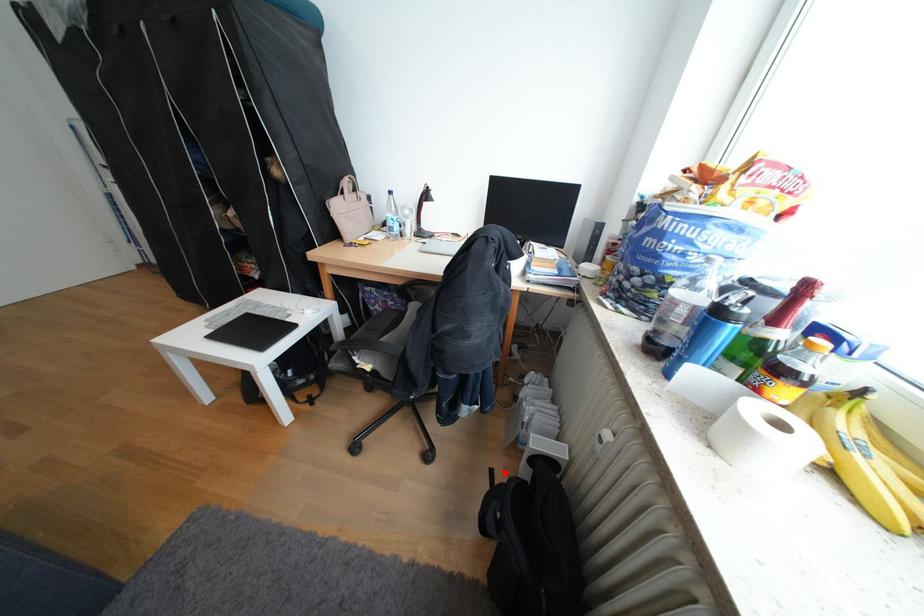
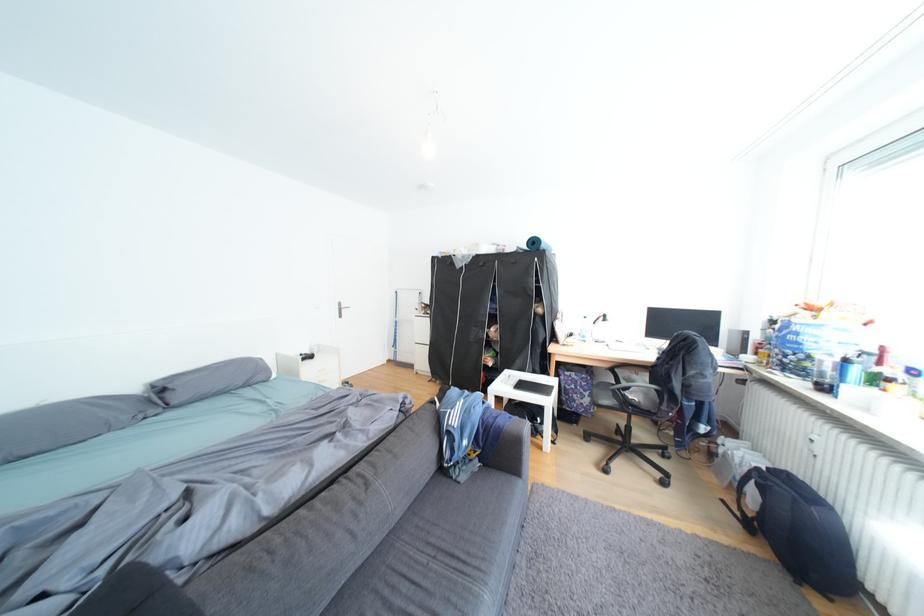
Find the pixel in the second image that matches the highlighted location in the first image.

(736, 501)